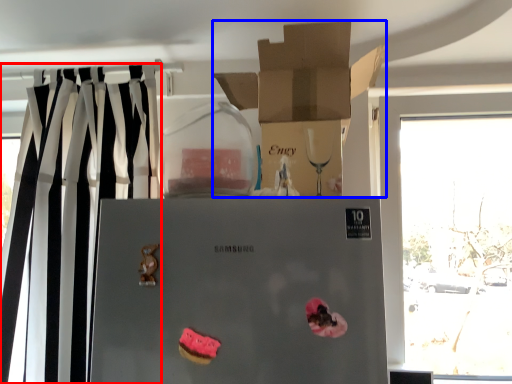
Question: Which object is closer to the camera taking this photo, curtain (highlighted by a red box) or box (highlighted by a blue box)?

Choices:
 (A) curtain
 (B) box

Answer: (B)